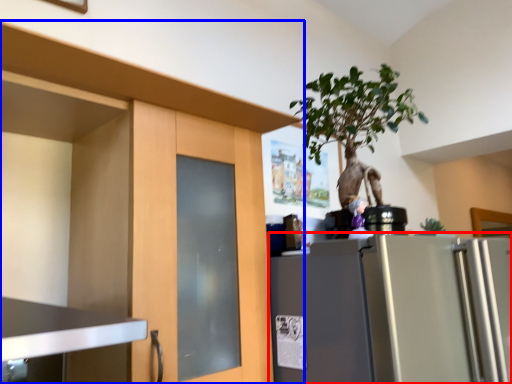
Question: Which of the following is the farthest to the observer, refrigerator (highlighted by a red box) or cabinetry (highlighted by a blue box)?

Choices:
 (A) refrigerator
 (B) cabinetry

Answer: (A)